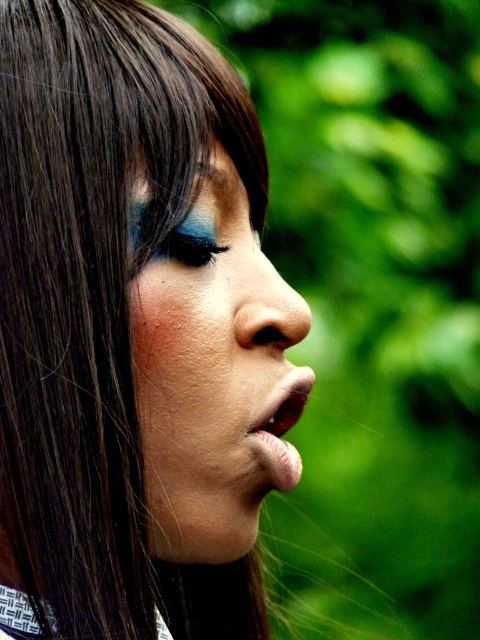
Between matte skin face at center and matte black eyebrow at upper center, which one is positioned lower?

matte skin face at center is lower down.

Does matte skin face at center have a greater width compared to matte black eyebrow at upper center?

Yes, matte skin face at center is wider than matte black eyebrow at upper center.

Is point (227, 250) closer to viewer compared to point (213, 173)?

No.

Find the location of a particular element. The image size is (480, 640). matte skin face at center is located at coordinates (214, 380).

Is point (288, 320) farther from camera compared to point (187, 401)?

Yes, point (288, 320) is behind point (187, 401).

Who is lower down, matte skin face at center or brown skin freckle at lower center?

matte skin face at center

Does point (227, 365) lie behind point (171, 392)?

That is True.

Find the location of a particular element. This screenshot has width=480, height=640. matte skin face at center is located at coordinates (214, 380).

Who is more distant from viewer, [288,412] or [211,218]?

→ Positioned behind is point [288,412].

What do you see at coordinates (214, 380) in the screenshot? I see `matte skin face at center` at bounding box center [214, 380].

This screenshot has width=480, height=640. What are the coordinates of `matte skin face at center` in the screenshot? It's located at (214, 380).